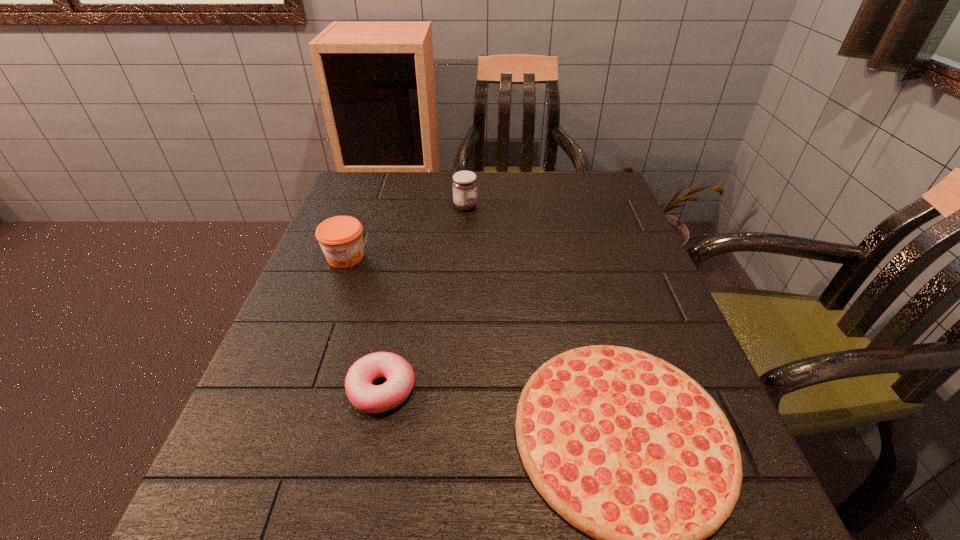
The width and height of the screenshot is (960, 540). I want to click on vacant area between the farthest object and the third tallest object, so click(423, 298).

You are a GUI agent. You are given a task and a screenshot of the screen. Output one action in this format:
    pyautogui.click(x=<x>, y=<y>)
    Task: Click on the blank region between the second farthest object and the farthest object
    The width and height of the screenshot is (960, 540).
    Given the screenshot: What is the action you would take?
    pos(405,232)

Locate an element on the screen. vacant space that is in between the left jam and the farther jam is located at coordinates (405, 232).

Where is `free spot between the nearer jam and the doughnut`? This screenshot has height=540, width=960. free spot between the nearer jam and the doughnut is located at coordinates (364, 323).

The image size is (960, 540). I want to click on vacant area that lies between the left jam and the doughnut, so click(364, 323).

Where is `unoccupied area between the second object from left to right and the farther jam`? This screenshot has height=540, width=960. unoccupied area between the second object from left to right and the farther jam is located at coordinates (423, 298).

The image size is (960, 540). What are the coordinates of `unoccupied area between the second farthest object and the farthest object` in the screenshot? It's located at 405,232.

Locate an element on the screen. the closest object to the right jam is located at coordinates (341, 239).

Find the location of a particular element. object that is the second closest to the second farthest object is located at coordinates (400, 376).

Where is `free spot that satisfies the following two spatial constraints: 1. on the front label of the third object from right to left; 2. on the left side of the nearer jam`? free spot that satisfies the following two spatial constraints: 1. on the front label of the third object from right to left; 2. on the left side of the nearer jam is located at coordinates (298, 389).